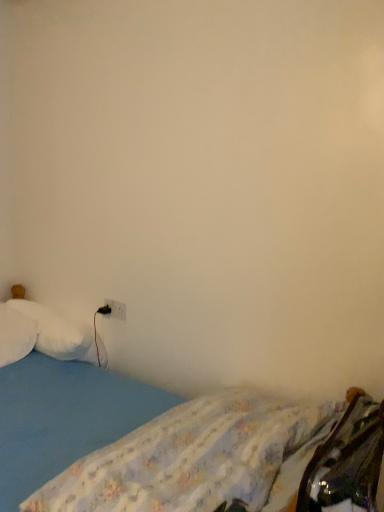
Question: Should I look upward or downward to see white soft pillow at left, placed as the first pillow when sorted from right to left?

Choices:
 (A) up
 (B) down

Answer: (B)

Question: Does white fluffy pillow at left, which ranks as the 1th pillow in left-to-right order, come in front of blue fabric bed at lower left?

Choices:
 (A) no
 (B) yes

Answer: (A)

Question: Is white fluffy pillow at left, which is counted as the 2th pillow, starting from the right, shorter than blue fabric bed at lower left?

Choices:
 (A) no
 (B) yes

Answer: (B)

Question: Can you confirm if white fluffy pillow at left, which ranks as the 1th pillow in left-to-right order, is positioned to the left of blue fabric bed at lower left?

Choices:
 (A) yes
 (B) no

Answer: (A)

Question: Considering the relative sizes of white fluffy pillow at left, which ranks as the 1th pillow in left-to-right order, and blue fabric bed at lower left in the image provided, is white fluffy pillow at left, which ranks as the 1th pillow in left-to-right order, taller than blue fabric bed at lower left?

Choices:
 (A) yes
 (B) no

Answer: (B)

Question: From a real-world perspective, is white fluffy pillow at left, which ranks as the 1th pillow in left-to-right order, physically below blue fabric bed at lower left?

Choices:
 (A) yes
 (B) no

Answer: (B)

Question: Does white fluffy pillow at left, which ranks as the 1th pillow in left-to-right order, lie behind blue fabric bed at lower left?

Choices:
 (A) yes
 (B) no

Answer: (A)

Question: Can you confirm if white plastic electric outlet at lower left is positioned to the left of white fluffy pillow at left, which is counted as the 2th pillow, starting from the right?

Choices:
 (A) no
 (B) yes

Answer: (A)

Question: Is white fluffy pillow at left, which ranks as the 1th pillow in left-to-right order, at the back of white plastic electric outlet at lower left?

Choices:
 (A) no
 (B) yes

Answer: (A)

Question: From a real-world perspective, is white plastic electric outlet at lower left on white fluffy pillow at left, which is counted as the 2th pillow, starting from the right?

Choices:
 (A) yes
 (B) no

Answer: (A)

Question: Does white plastic electric outlet at lower left appear on the right side of white fluffy pillow at left, which ranks as the 1th pillow in left-to-right order?

Choices:
 (A) yes
 (B) no

Answer: (A)

Question: Does white plastic electric outlet at lower left have a lesser height compared to white fluffy pillow at left, which ranks as the 1th pillow in left-to-right order?

Choices:
 (A) no
 (B) yes

Answer: (B)

Question: Does white plastic electric outlet at lower left have a lesser width compared to white fluffy pillow at left, which ranks as the 1th pillow in left-to-right order?

Choices:
 (A) yes
 (B) no

Answer: (A)

Question: Can you confirm if white plastic electric outlet at lower left is bigger than blue fabric bed at lower left?

Choices:
 (A) yes
 (B) no

Answer: (B)